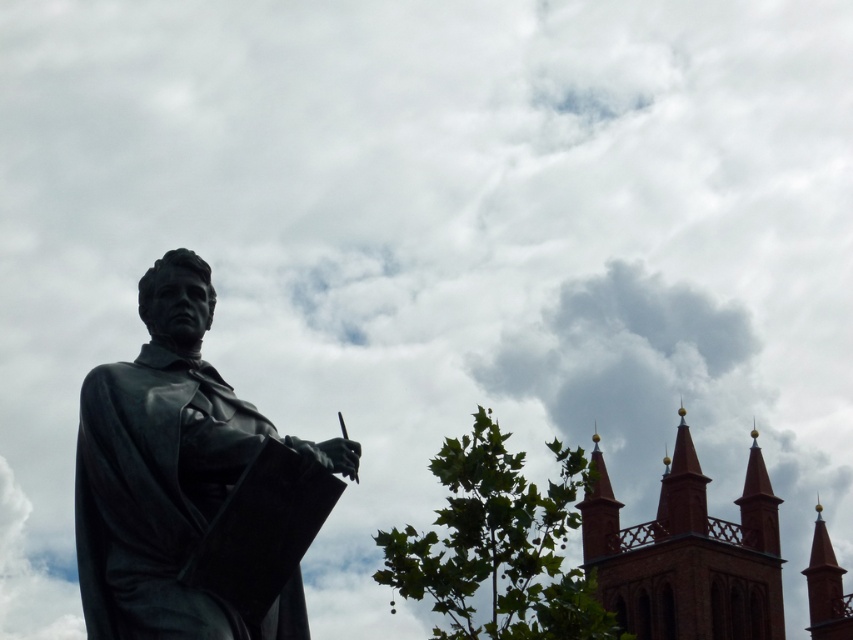
Between bronze statue at left and brick steeple at upper right, which one appears on the right side from the viewer's perspective?

brick steeple at upper right is more to the right.

Which is above, bronze statue at left or brick steeple at upper right?

bronze statue at left is higher up.

Is point (160, 385) less distant than point (811, 586)?

Yes.

This screenshot has height=640, width=853. What are the coordinates of `bronze statue at left` in the screenshot? It's located at (170, 474).

Between dark brown stone tower at upper right and brick spire at upper right, which one has less height?

brick spire at upper right

Which is in front, point (614, 504) or point (602, 525)?

Positioned in front is point (602, 525).

You are a GUI agent. You are given a task and a screenshot of the screen. Output one action in this format:
    pyautogui.click(x=<x>, y=<y>)
    Task: Click on the dark brown stone tower at upper right
    Image resolution: width=853 pixels, height=640 pixels.
    Given the screenshot: What is the action you would take?
    pyautogui.click(x=688, y=554)

Is point (814, 621) positioned after point (590, 483)?

Yes.

Does brick steeple at upper right appear under brick spire at upper right?

Correct, brick steeple at upper right is located below brick spire at upper right.

Is point (824, 531) farther from viewer compared to point (612, 513)?

Yes, it is behind point (612, 513).

This screenshot has height=640, width=853. In order to click on brick steeple at upper right in this screenshot , I will do `click(827, 588)`.